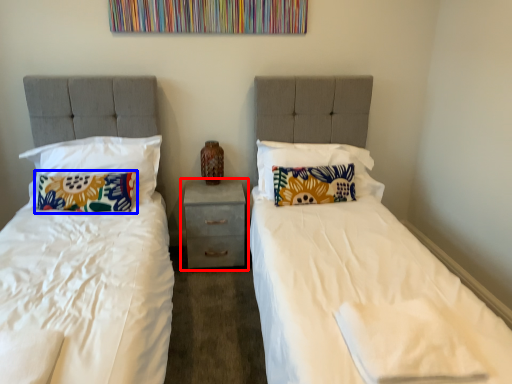
Question: Which object is closer to the camera taking this photo, nightstand (highlighted by a red box) or pillow (highlighted by a blue box)?

Choices:
 (A) nightstand
 (B) pillow

Answer: (B)